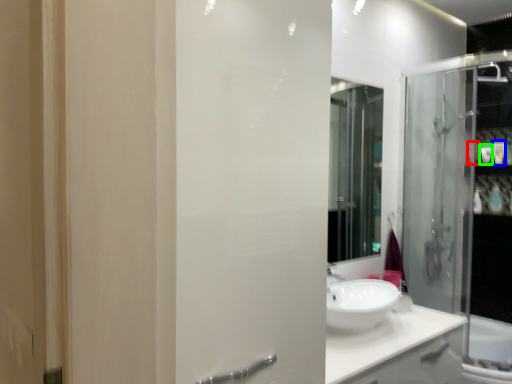
Question: Which object is the closest to the toiletry (highlighted by a red box)? Choose among these: toiletry (highlighted by a blue box) or toiletry (highlighted by a green box).

Choices:
 (A) toiletry
 (B) toiletry

Answer: (B)